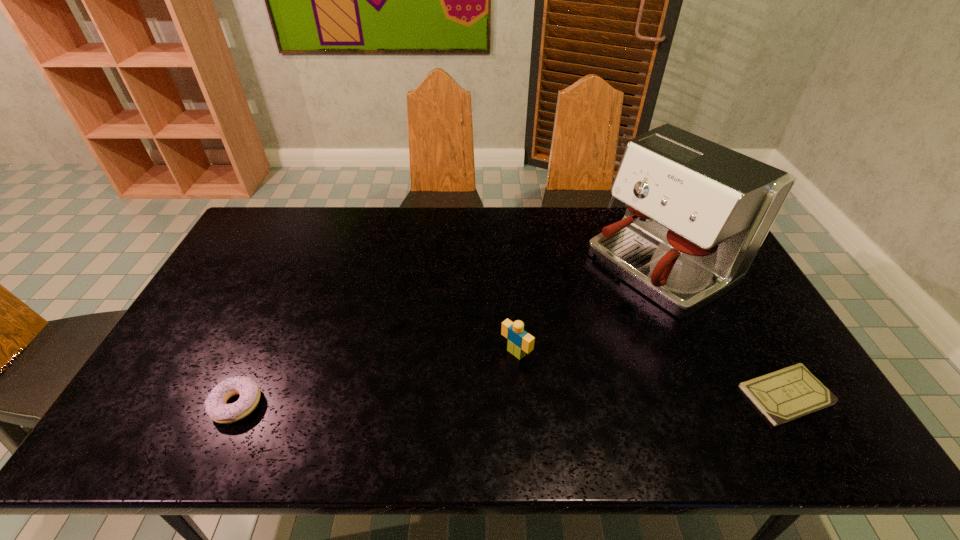
Find the location of a particular element. This screenshot has height=540, width=960. the leftmost object is located at coordinates (215, 405).

The width and height of the screenshot is (960, 540). I want to click on the third tallest object, so click(215, 405).

In order to click on checkbook in this screenshot , I will do `click(782, 396)`.

Locate an element on the screen. The width and height of the screenshot is (960, 540). the second farthest object is located at coordinates (520, 342).

The image size is (960, 540). What are the coordinates of `Lego` in the screenshot? It's located at (520, 342).

In order to click on coffee maker in this screenshot , I will do `click(697, 213)`.

Where is `the farthest object`? the farthest object is located at coordinates (697, 213).

Image resolution: width=960 pixels, height=540 pixels. In order to click on vacant space located on the left of the leftmost object in this screenshot , I will do `click(159, 404)`.

Locate an element on the screen. The height and width of the screenshot is (540, 960). vacant space situated 0.150m on the back of the checkbook is located at coordinates (744, 323).

Where is `free location located on the face of the Lego`? free location located on the face of the Lego is located at coordinates (453, 408).